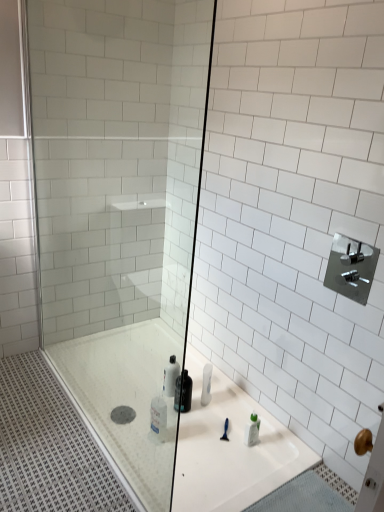
Question: Should I look upward or downward to see satin nickel faucet at upper right?

Choices:
 (A) down
 (B) up

Answer: (A)

Question: From a real-world perspective, is satin nickel faucet at upper right below transparent glass shower door at center?

Choices:
 (A) no
 (B) yes

Answer: (A)

Question: Are satin nickel faucet at upper right and transparent glass shower door at center making contact?

Choices:
 (A) yes
 (B) no

Answer: (B)

Question: From the image's perspective, is satin nickel faucet at upper right beneath transparent glass shower door at center?

Choices:
 (A) no
 (B) yes

Answer: (B)

Question: Is transparent glass shower door at center inside satin nickel faucet at upper right?

Choices:
 (A) yes
 (B) no

Answer: (B)

Question: Can you confirm if satin nickel faucet at upper right is thinner than transparent glass shower door at center?

Choices:
 (A) no
 (B) yes

Answer: (B)

Question: Is satin nickel faucet at upper right not inside transparent glass shower door at center?

Choices:
 (A) yes
 (B) no

Answer: (A)

Question: Is translucent plastic bottle at center smaller than transparent glass shower door at center?

Choices:
 (A) yes
 (B) no

Answer: (A)

Question: Is translucent plastic bottle at center facing towards transparent glass shower door at center?

Choices:
 (A) yes
 (B) no

Answer: (A)

Question: Is translucent plastic bottle at center surrounding transparent glass shower door at center?

Choices:
 (A) no
 (B) yes

Answer: (A)

Question: Is translucent plastic bottle at center further to camera compared to transparent glass shower door at center?

Choices:
 (A) no
 (B) yes

Answer: (B)

Question: From a real-world perspective, is translucent plastic bottle at center positioned under transparent glass shower door at center based on gravity?

Choices:
 (A) yes
 (B) no

Answer: (A)

Question: Can you confirm if translucent plastic bottle at center is wider than transparent glass shower door at center?

Choices:
 (A) yes
 (B) no

Answer: (B)

Question: Is transparent glass shower door at center aimed at satin nickel faucet at upper right?

Choices:
 (A) yes
 (B) no

Answer: (B)